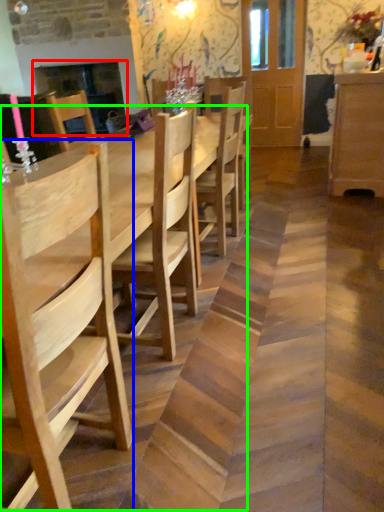
Question: Considering the real-world distances, which object is closest to fireplace (highlighted by a red box)? chair (highlighted by a blue box) or table (highlighted by a green box).

Choices:
 (A) chair
 (B) table

Answer: (B)